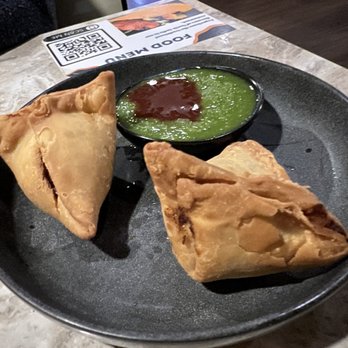
Find the location of `placemat upper right of plate`. placemat upper right of plate is located at coordinates (278, 48).